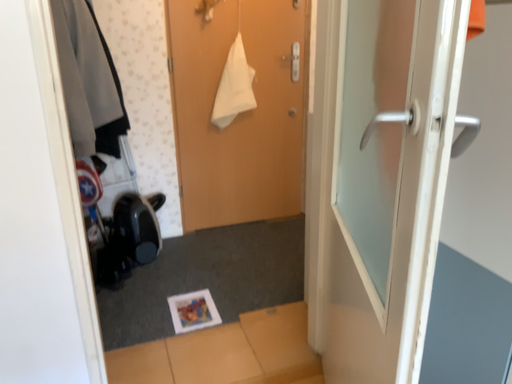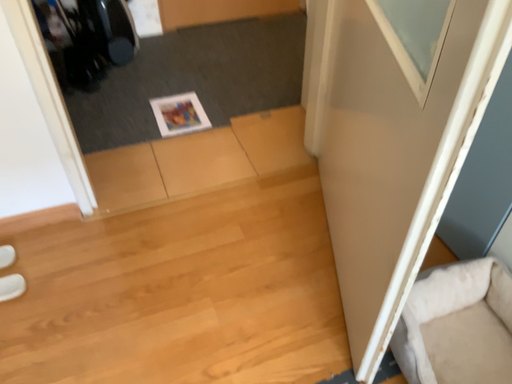
Question: Which way did the camera rotate in the video?

Choices:
 (A) rotated upward
 (B) rotated downward

Answer: (B)